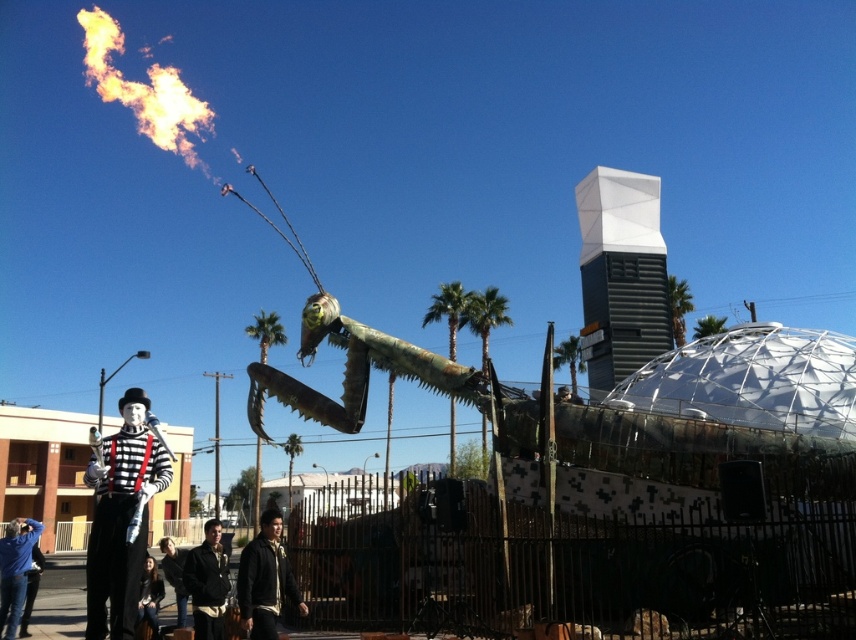
Question: Is silver metallic clown at lower left positioned before dark brown leather jacket at center?

Choices:
 (A) no
 (B) yes

Answer: (B)

Question: Does silver metallic clown at lower left appear over dark gray jacket at center?

Choices:
 (A) yes
 (B) no

Answer: (A)

Question: Which object is the closest to the dark gray jacket at center?

Choices:
 (A) silver metallic clown at lower left
 (B) dark brown leather jacket at center

Answer: (B)

Question: Which object is the closest to the dark gray jacket at center?

Choices:
 (A) dark brown leather jacket at center
 (B) silver metallic clown at lower left

Answer: (A)

Question: Can you confirm if silver metallic clown at lower left is smaller than dark gray jacket at center?

Choices:
 (A) yes
 (B) no

Answer: (B)

Question: Which is nearer to the dark gray jacket at center?

Choices:
 (A) dark brown leather jacket at center
 (B) silver metallic clown at lower left

Answer: (A)